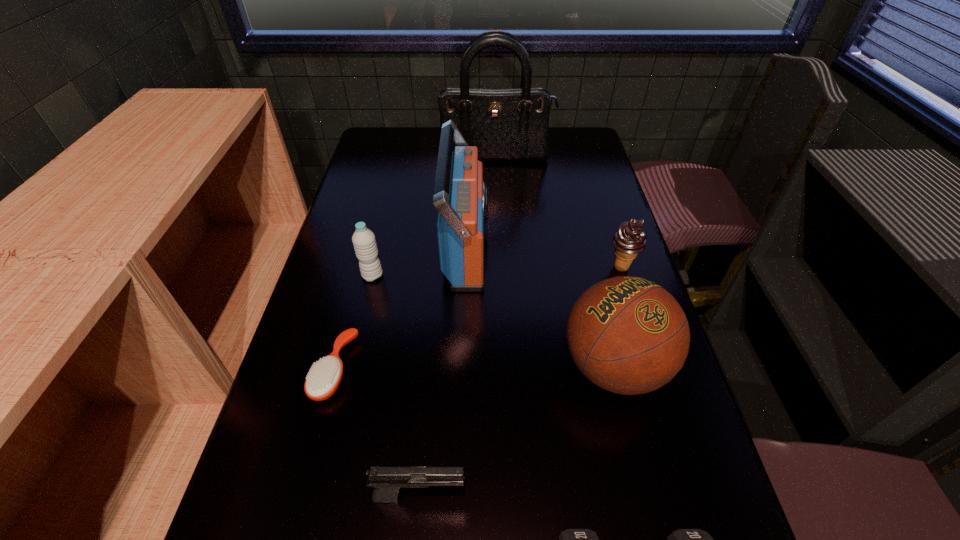
Identify the location of vacant space located on the front-facing side of the radio receiver. (527, 249).

Find the location of a particular element. Image resolution: width=960 pixels, height=540 pixels. vacant point located on the left of the sixth shortest object is located at coordinates (514, 367).

Where is `free location located on the right of the water bottle`? free location located on the right of the water bottle is located at coordinates (418, 276).

Find the location of a particular element. This screenshot has width=960, height=540. free space located 0.200m on the back of the icecream is located at coordinates (604, 212).

Find the location of a particular element. free location located 0.310m aim along the barrel of the third shortest object is located at coordinates (642, 495).

The image size is (960, 540). Identify the location of vacant position located 0.080m on the right of the shortest object. (391, 369).

The image size is (960, 540). What are the coordinates of `object that is at the far edge` in the screenshot? It's located at (504, 124).

In order to click on water bottle at the left edge in this screenshot , I will do `click(364, 242)`.

Find the location of a particular element. This screenshot has width=960, height=540. hairbrush that is at the left edge is located at coordinates (324, 377).

Find the location of `handbag that is positioned at the right edge`. handbag that is positioned at the right edge is located at coordinates (504, 124).